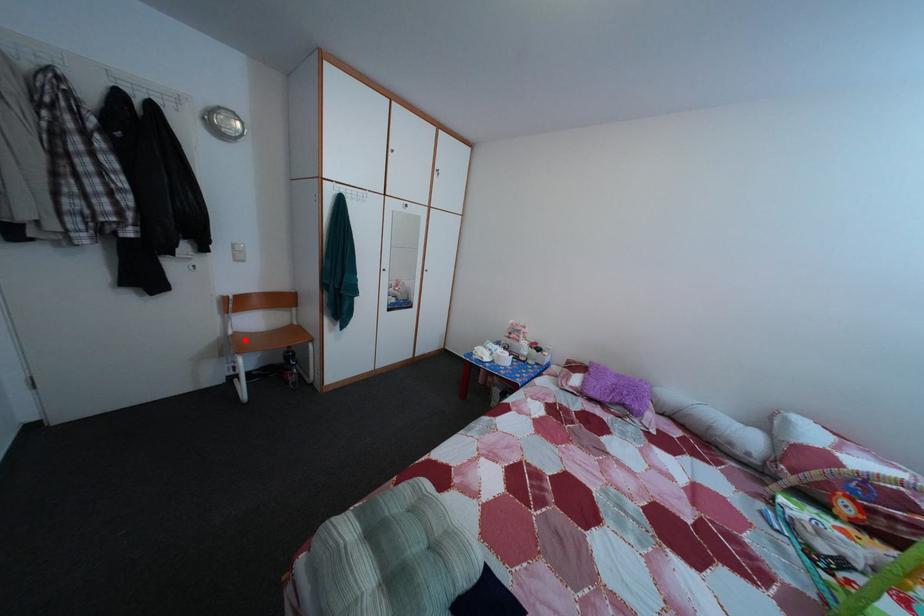
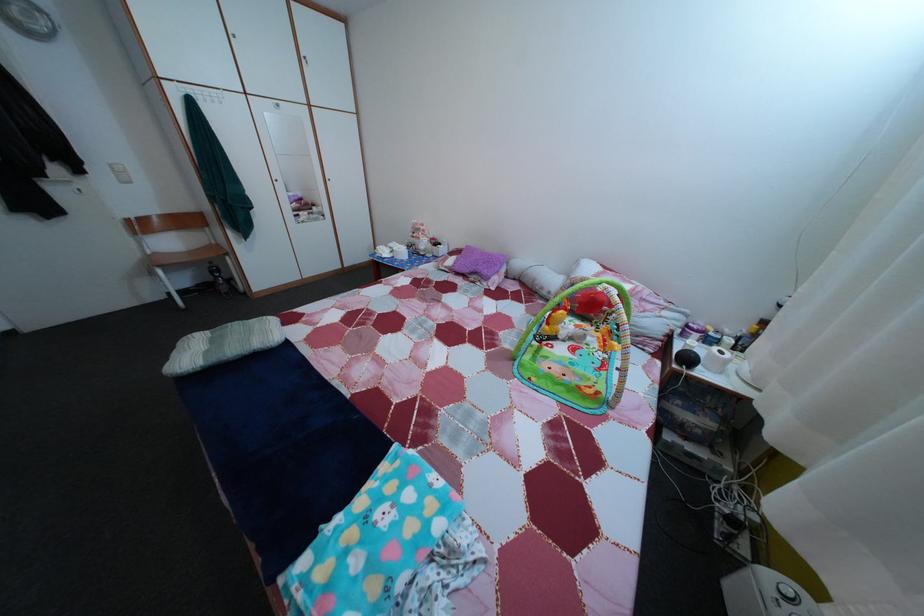
Where in the second image is the point corresponding to the highlighted location from the first image?

(164, 261)